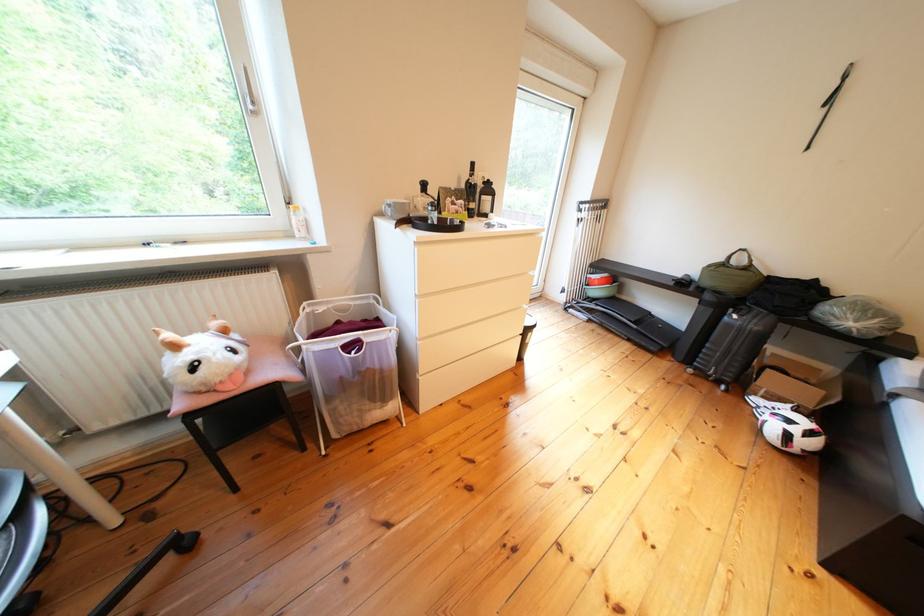
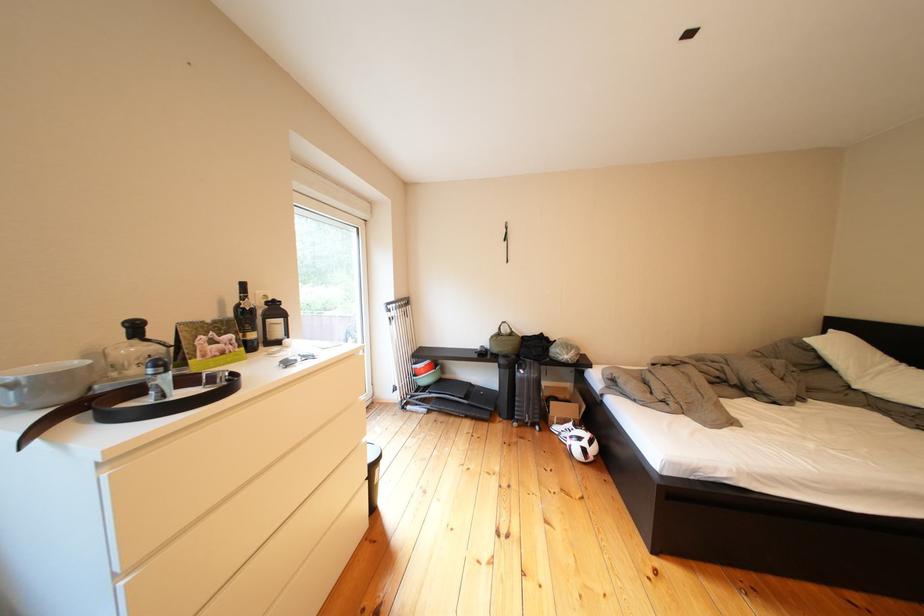
Question: The camera is either moving clockwise (left) or counter-clockwise (right) around the object. The first image is from the beginning of the video and the second image is from the end. Is the camera moving left or right when shooting the video?

Choices:
 (A) Left
 (B) Right

Answer: (A)